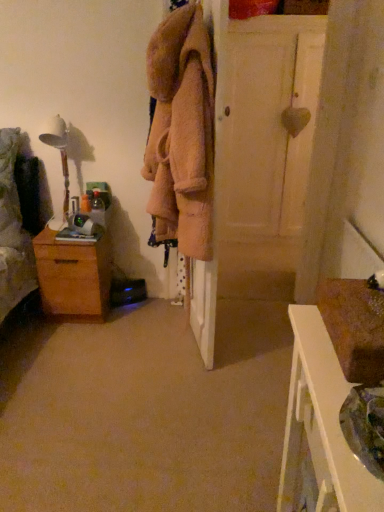
Question: Is wooden table lamp at left oriented away from fuzzy beige coat at center?

Choices:
 (A) no
 (B) yes

Answer: (A)

Question: Does wooden table lamp at left have a lesser height compared to fuzzy beige coat at center?

Choices:
 (A) no
 (B) yes

Answer: (B)

Question: From a real-world perspective, is wooden table lamp at left below fuzzy beige coat at center?

Choices:
 (A) no
 (B) yes

Answer: (B)

Question: Considering the relative sizes of wooden table lamp at left and fuzzy beige coat at center in the image provided, is wooden table lamp at left bigger than fuzzy beige coat at center?

Choices:
 (A) no
 (B) yes

Answer: (A)

Question: Can you confirm if wooden table lamp at left is positioned to the right of fuzzy beige coat at center?

Choices:
 (A) yes
 (B) no

Answer: (B)

Question: Would you say wooden table lamp at left is outside fuzzy beige coat at center?

Choices:
 (A) no
 (B) yes

Answer: (B)

Question: From a real-world perspective, is white wood nightstand at lower right positioned under wooden chest of drawers at left based on gravity?

Choices:
 (A) no
 (B) yes

Answer: (A)

Question: Can you confirm if white wood nightstand at lower right is wider than wooden chest of drawers at left?

Choices:
 (A) no
 (B) yes

Answer: (A)

Question: Considering the relative sizes of white wood nightstand at lower right and wooden chest of drawers at left in the image provided, is white wood nightstand at lower right bigger than wooden chest of drawers at left?

Choices:
 (A) no
 (B) yes

Answer: (B)

Question: Is white wood nightstand at lower right to the right of wooden chest of drawers at left from the viewer's perspective?

Choices:
 (A) no
 (B) yes

Answer: (B)

Question: Is white wood nightstand at lower right placed right next to wooden chest of drawers at left?

Choices:
 (A) yes
 (B) no

Answer: (B)

Question: Can you confirm if white wood nightstand at lower right is shorter than wooden chest of drawers at left?

Choices:
 (A) yes
 (B) no

Answer: (B)

Question: Is white wood nightstand at lower right bigger than white matte door at center?

Choices:
 (A) no
 (B) yes

Answer: (A)